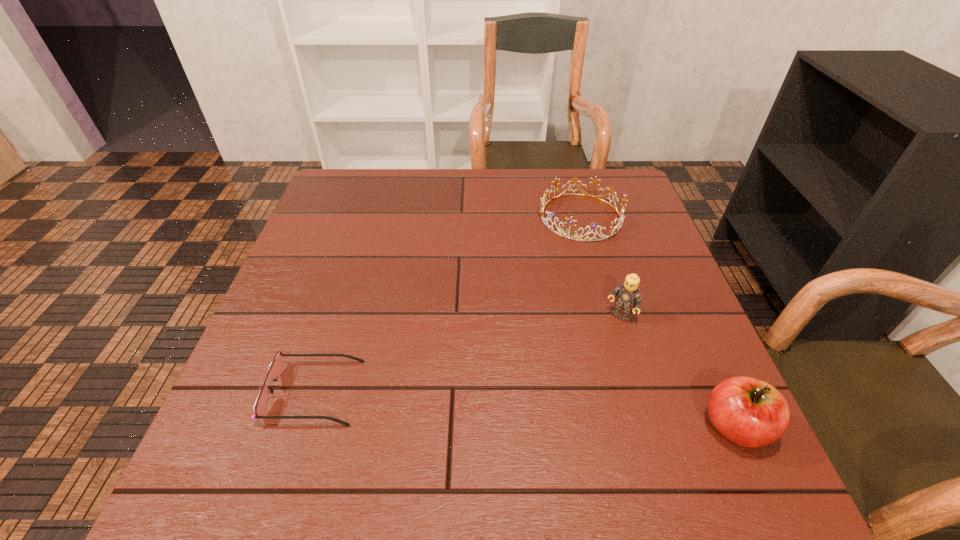
Identify the location of tiara that is at the right edge. (570, 221).

Find the location of a particular element. object that is at the near left corner is located at coordinates (275, 368).

In order to click on object positioned at the far right corner in this screenshot , I will do `click(570, 221)`.

Identify the location of object at the near right corner. Image resolution: width=960 pixels, height=540 pixels. (749, 412).

In the image, there is a desktop. At what (x,y) coordinates should I click in order to perform the action: click on free region at the far edge. Please return your answer as a coordinate pair (x, y). Looking at the image, I should click on (567, 215).

The height and width of the screenshot is (540, 960). I want to click on free spot at the near edge of the desktop, so click(423, 429).

In the image, there is a desktop. Where is `free space at the left edge`? The image size is (960, 540). free space at the left edge is located at coordinates (276, 299).

What are the coordinates of `vacant space at the right edge` in the screenshot? It's located at (656, 377).

In order to click on vacant space at the near left corner in this screenshot , I will do `click(293, 438)`.

This screenshot has height=540, width=960. Identify the location of free space at the near right corner of the desktop. (643, 404).